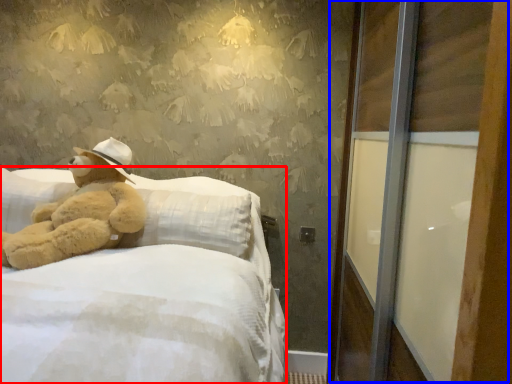
Question: Among these objects, which one is farthest to the camera, bed (highlighted by a red box) or screen door (highlighted by a blue box)?

Choices:
 (A) bed
 (B) screen door

Answer: (B)